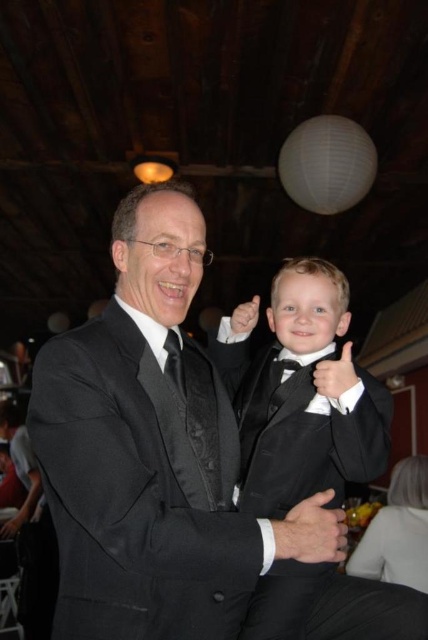
Question: Is black satin tie at center in front of black satin bow tie at center?

Choices:
 (A) yes
 (B) no

Answer: (A)

Question: Does black satin tuxedo at center appear on the left side of black satin tie at center?

Choices:
 (A) no
 (B) yes

Answer: (A)

Question: Can you confirm if black satin tuxedo at center is positioned to the left of black satin tie at center?

Choices:
 (A) no
 (B) yes

Answer: (A)

Question: Which point is farther from the camera taking this photo?

Choices:
 (A) (410, 602)
 (B) (193, 419)

Answer: (A)

Question: Which point is farther to the camera?

Choices:
 (A) black satin tie at center
 (B) black satin tuxedo at center

Answer: (A)

Question: Among these objects, which one is farthest from the camera?

Choices:
 (A) black satin bow tie at center
 (B) black satin tie at center
 (C) black satin tuxedo at center

Answer: (A)